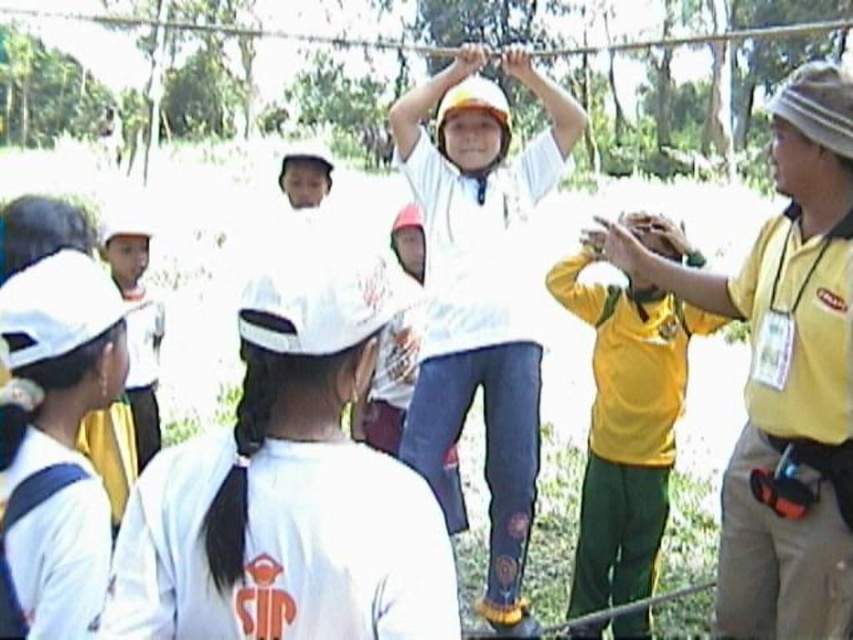
Question: Which object appears farthest from the camera in this image?

Choices:
 (A) yellow matte shirt at center
 (B) white matte hoodie at center

Answer: (A)

Question: Is yellow fabric shirt at right in front of yellow fabric badge at right?

Choices:
 (A) yes
 (B) no

Answer: (B)

Question: From the image, what is the correct spatial relationship of white matte hoodie at center in relation to white matte uniform at lower left?

Choices:
 (A) left
 (B) right

Answer: (B)

Question: Based on their relative distances, which object is nearer to the yellow fabric shirt at right?

Choices:
 (A) white matte hoodie at center
 (B) white matte shirt at center

Answer: (A)

Question: Which of the following is the closest to the observer?

Choices:
 (A) white matte shirt at center
 (B) white matte hoodie at center

Answer: (A)

Question: In this image, where is white matte shirt at center located relative to white matte uniform at lower left?

Choices:
 (A) left
 (B) right

Answer: (B)